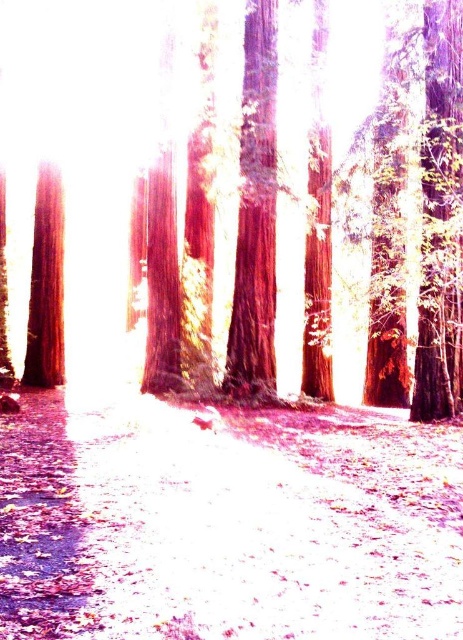
You are standing at the center of the brown dirt path at center in a forest. You want to walk straight ahead. Based on the scene description, will you eventually reach an open area or continue through dense trees?

The scene description mentions that the forest has densely packed trees creating a dense canopy, so walking straight ahead along the brown dirt path at center would continue through the dense trees rather than leading to an open area.

You are a hiker trying to find the shortest route through the forest. You notice a brown dirt path at center and a smooth brown tree trunk at left. Which of these two features is shorter in height?

The brown dirt path at center is not as tall as the smooth brown tree trunk at left, so the brown dirt path at center is shorter in height.